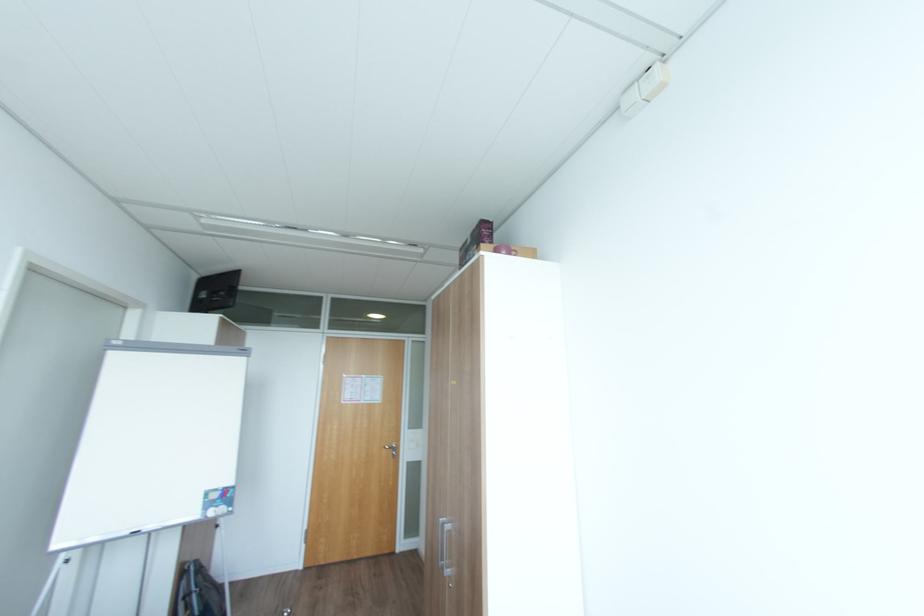
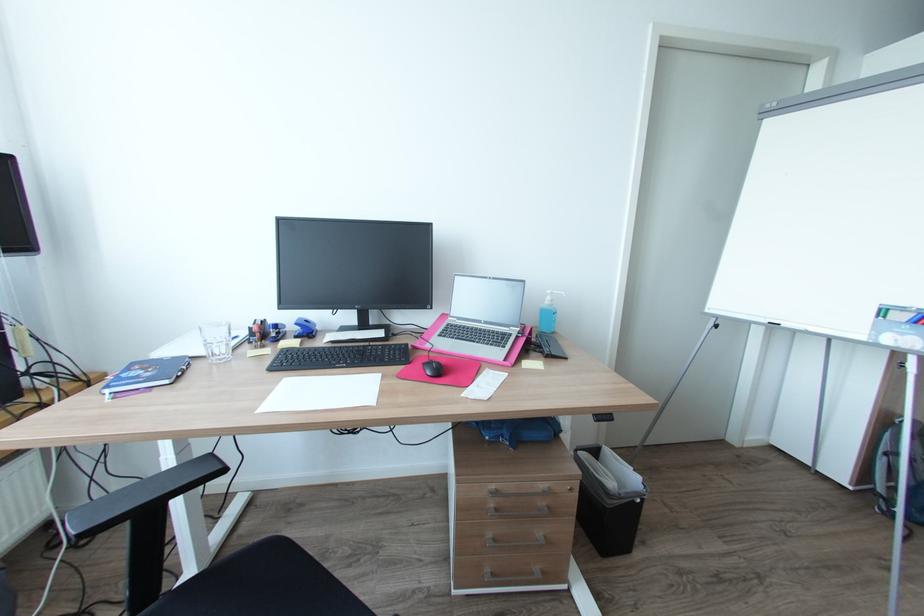
Locate, in the second image, the point that corresponds to the point at 59,546 in the first image.

(712, 310)